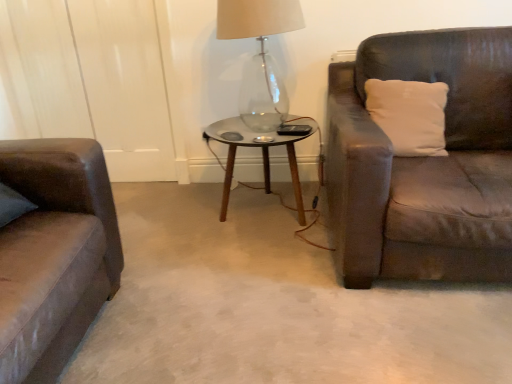
Question: Relative to white soft pillow at right, is transparent glass coffee table at center in front or behind?

Choices:
 (A) front
 (B) behind

Answer: (B)

Question: Looking at the image, does transparent glass coffee table at center seem bigger or smaller compared to white soft pillow at right?

Choices:
 (A) big
 (B) small

Answer: (A)

Question: Estimate the real-world distances between objects in this image. Which object is closer to the white soft pillow at right?

Choices:
 (A) transparent glass table lamp at center
 (B) transparent glass coffee table at center

Answer: (B)

Question: Considering the real-world distances, which object is closest to the transparent glass coffee table at center?

Choices:
 (A) white soft pillow at right
 (B) transparent glass table lamp at center

Answer: (B)